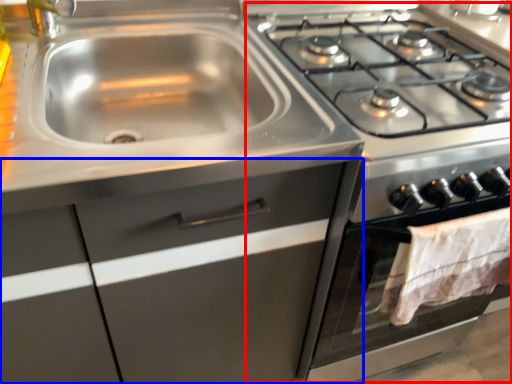
Question: Which point is further to the camera, appliance (highlighted by a red box) or cabinetry (highlighted by a blue box)?

Choices:
 (A) appliance
 (B) cabinetry

Answer: (A)